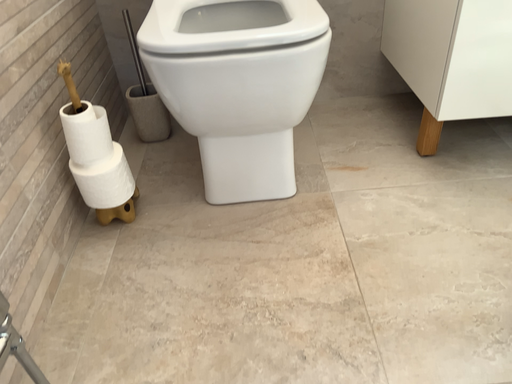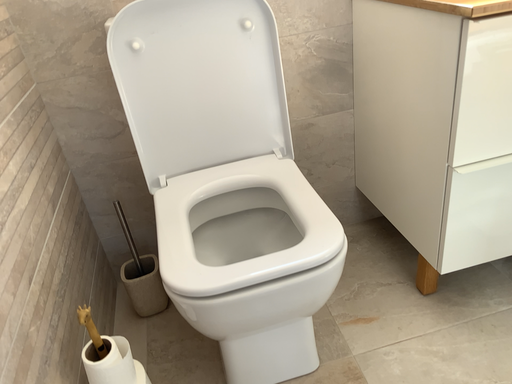
Question: Which way did the camera rotate in the video?

Choices:
 (A) rotated downward
 (B) rotated upward

Answer: (B)